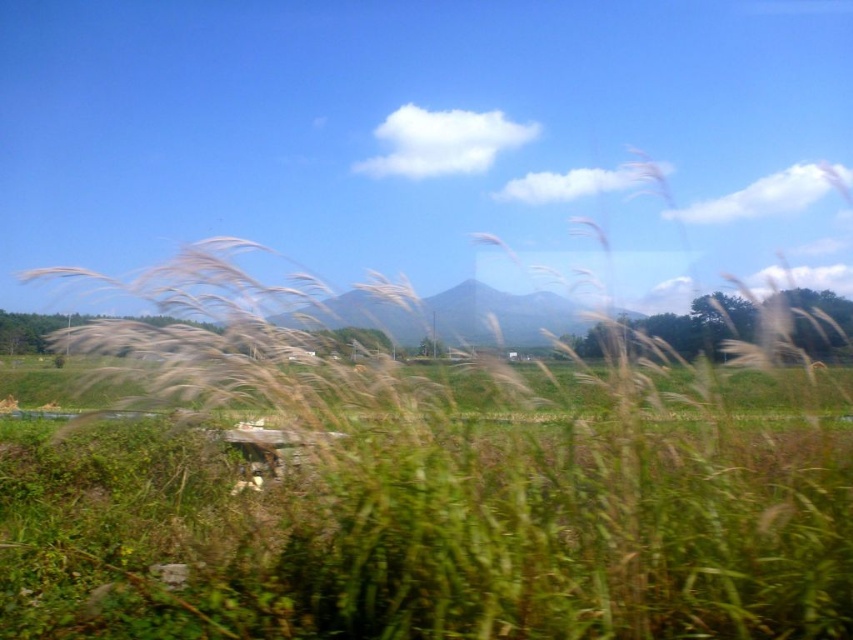
Looking at this image, can you confirm if white fluffy grass at center is shorter than green matte mountain at center?

In fact, white fluffy grass at center may be taller than green matte mountain at center.

Measure the distance between white fluffy grass at center and green matte mountain at center.

white fluffy grass at center and green matte mountain at center are 3.85 meters apart.

Is point (645, 525) positioned in front of point (340, 301)?

Yes, it is.

Where is `white fluffy grass at center`? This screenshot has height=640, width=853. white fluffy grass at center is located at coordinates (436, 532).